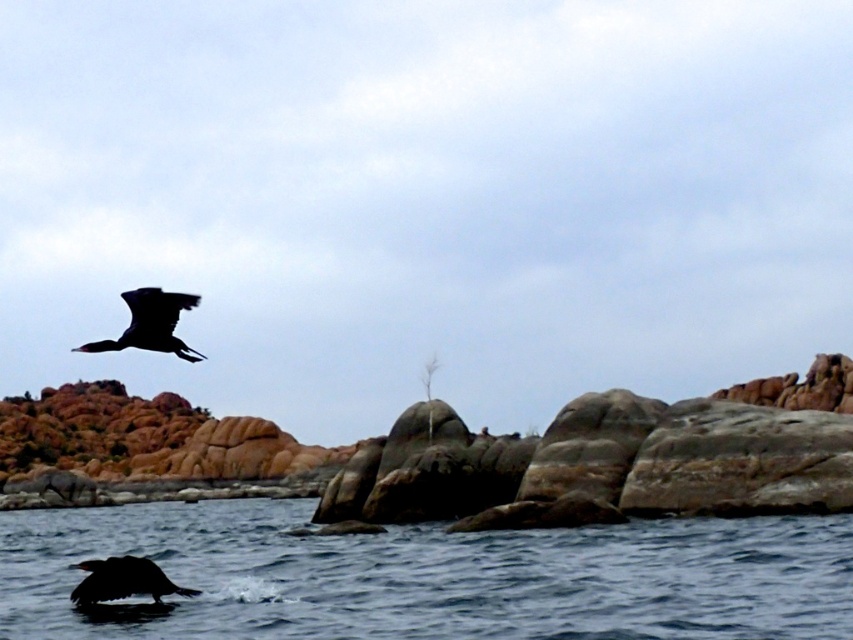
Is point (453, 632) more distant than point (170, 324)?

No, it is in front of (170, 324).

Between smooth dark blue water at lower center and shiny black bird at upper left, which one has more height?

With more height is smooth dark blue water at lower center.

This screenshot has height=640, width=853. I want to click on smooth dark blue water at lower center, so click(433, 577).

This screenshot has height=640, width=853. I want to click on smooth dark blue water at lower center, so click(433, 577).

The height and width of the screenshot is (640, 853). Find the location of `smooth dark blue water at lower center`. smooth dark blue water at lower center is located at coordinates (433, 577).

Looking at this image, does smooth dark blue water at lower center lie in front of silhouette glossy bird at lower left?

Yes.

Which is in front, point (793, 564) or point (134, 564)?

Point (134, 564) is more forward.

Locate an element on the screen. smooth dark blue water at lower center is located at coordinates (433, 577).

Consider the image. Is shiny black bird at upper left bigger than silhouette glossy bird at lower left?

Indeed, shiny black bird at upper left has a larger size compared to silhouette glossy bird at lower left.

Is shiny black bird at upper left to the right of silhouette glossy bird at lower left from the viewer's perspective?

Incorrect, shiny black bird at upper left is not on the right side of silhouette glossy bird at lower left.

Is point (161, 332) positioned before point (73, 589)?

Yes, point (161, 332) is in front of point (73, 589).

Find the location of a particular element. shiny black bird at upper left is located at coordinates (149, 323).